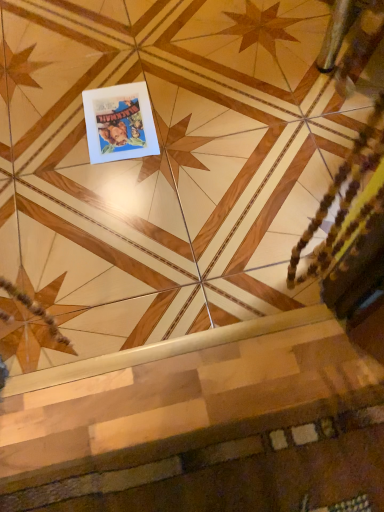
This screenshot has width=384, height=512. In order to click on white matte picture frame at upper center in this screenshot , I will do `click(119, 123)`.

The height and width of the screenshot is (512, 384). What do you see at coordinates (119, 123) in the screenshot? I see `white matte picture frame at upper center` at bounding box center [119, 123].

Locate an element on the screen. The image size is (384, 512). white matte picture frame at upper center is located at coordinates (119, 123).